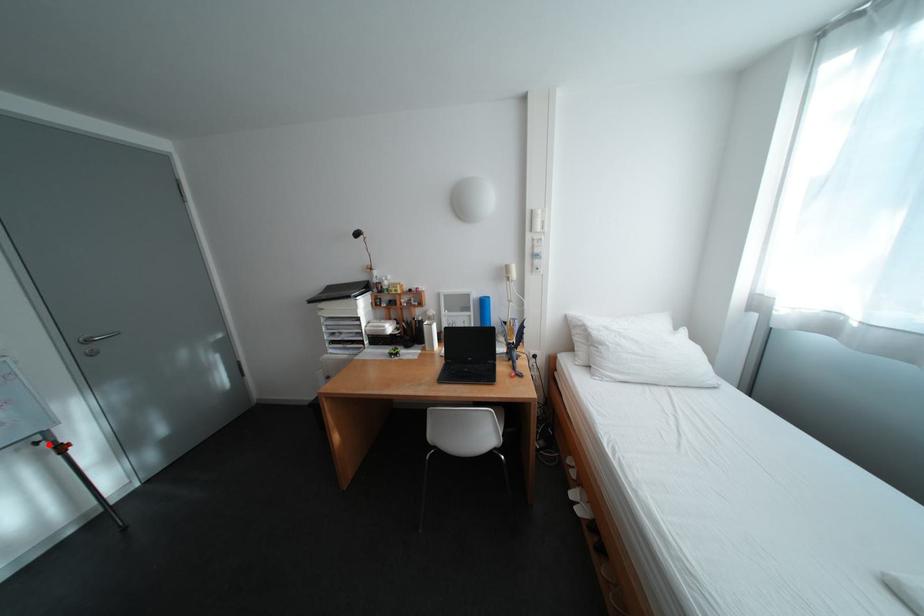
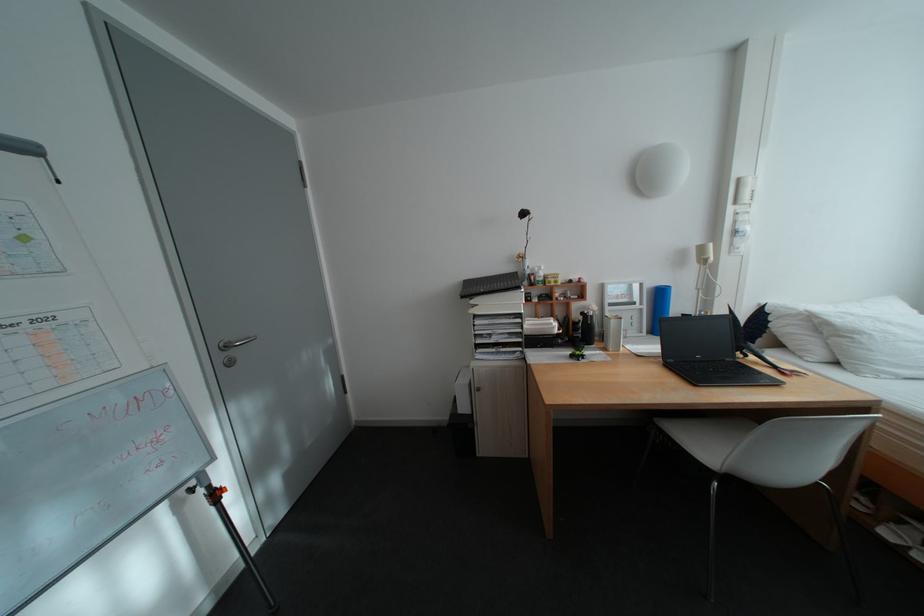
Locate, in the second image, the point that corresponds to the highlighted location in the first image.

(203, 492)